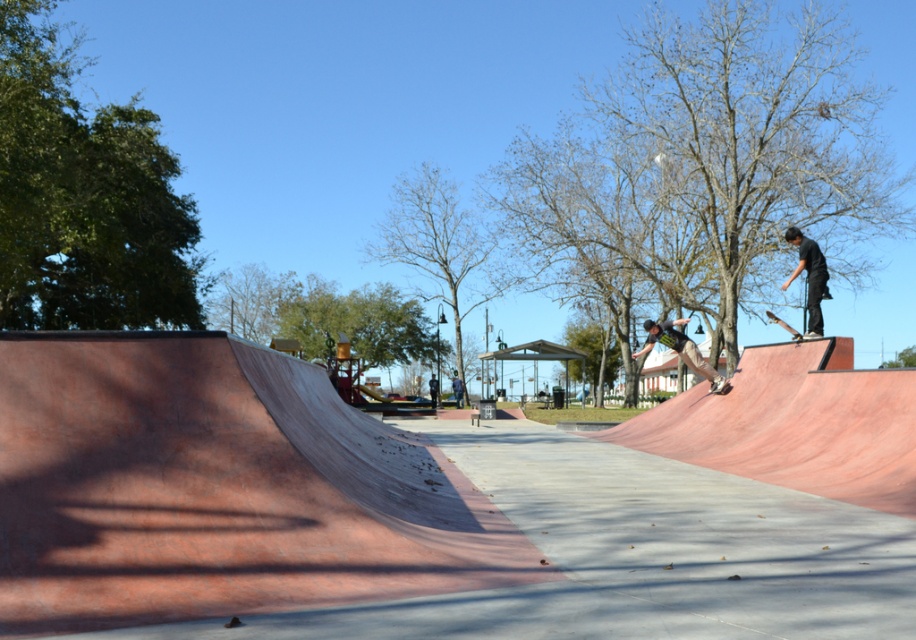
You are a photographer positioned at the edge of the skate park, aiming to capture the smooth concrete ramp at center. Given that your camera can only focus on objects within a 0.5 unit radius from your current position at point (386, 515), will you be able to focus on the ramp?

The point (386, 515) corresponds to the smooth concrete ramp at center, so yes, the camera can focus on the ramp since it is exactly at the specified coordinates within the 0.5 unit radius.

You are a photographer planning to take a photo of the smooth concrete ramp at center and the matte black skateboarder at center. Based on their sizes, which object should you focus on first to ensure it appears sharp in the photo?

The smooth concrete ramp at center is larger in size than the matte black skateboarder at center, so you should focus on the smooth concrete ramp at center first to ensure it appears sharp in the photo.